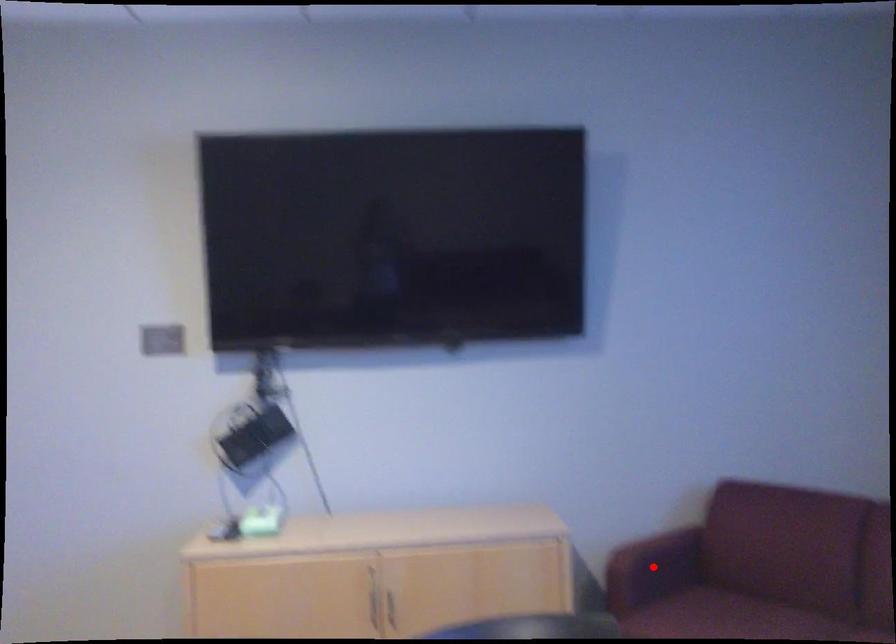
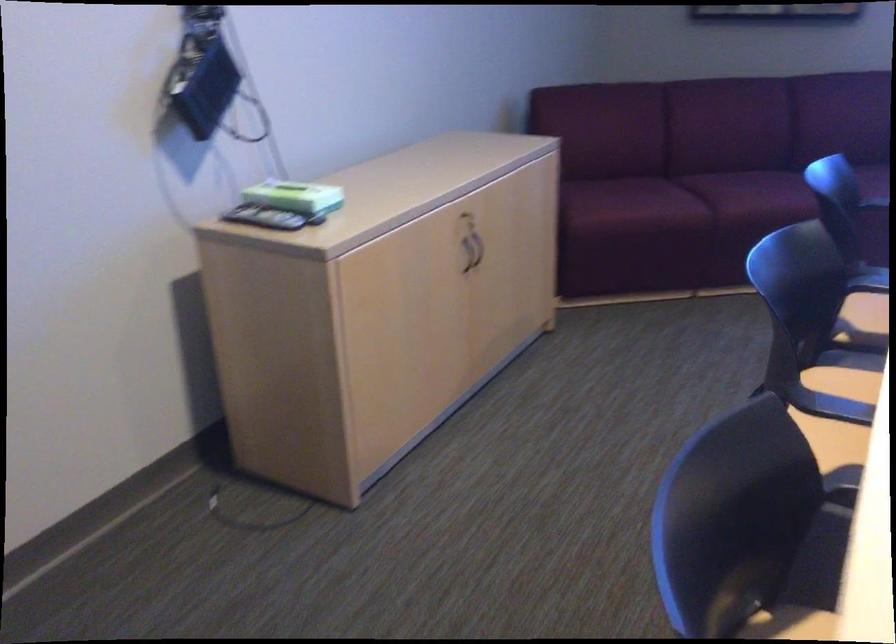
Question: I am providing you with two images of the same scene from different viewpoints. A red point is marked on the first image. Is the red point's position out of view in image 2?

Choices:
 (A) Yes
 (B) No

Answer: (A)